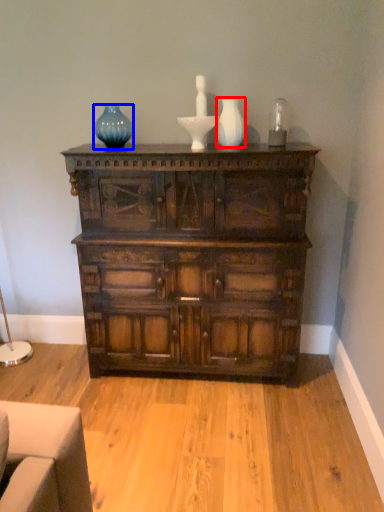
Question: Which of the following is the farthest to the observer, vase (highlighted by a red box) or glass vase (highlighted by a blue box)?

Choices:
 (A) vase
 (B) glass vase

Answer: (B)